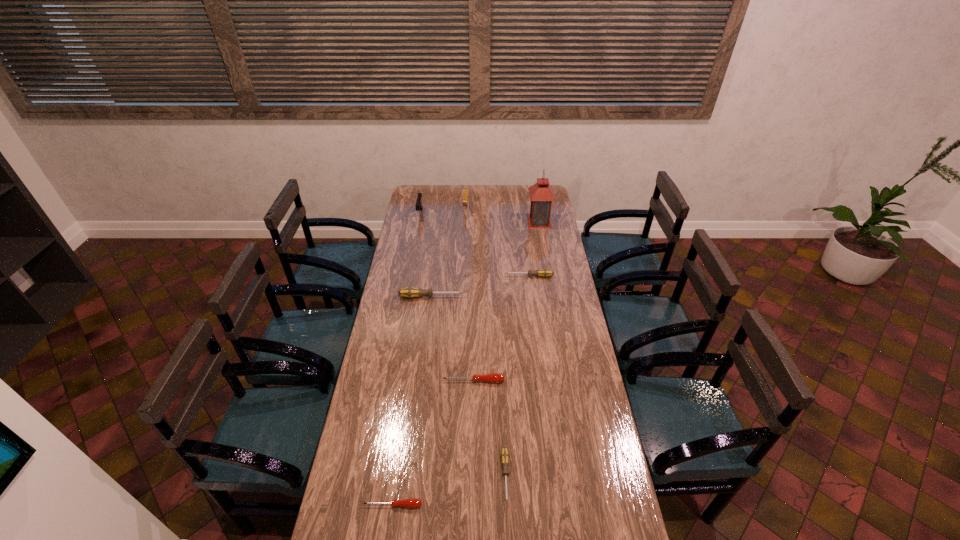
I want to click on vacant space situated 0.110m at the tip of the farthest screwdriver, so click(x=483, y=276).

What are the coordinates of `vacant space located 0.060m on the back of the right red screwdriver` in the screenshot? It's located at (473, 364).

Where is `vacant area situated at the tip of the second gray screwdriver from right to left`? vacant area situated at the tip of the second gray screwdriver from right to left is located at coordinates click(x=508, y=530).

At what (x,y) coordinates should I click in order to perform the action: click on vacant space situated on the right of the nearer red screwdriver. Please return your answer as a coordinate pair (x, y). This screenshot has height=540, width=960. Looking at the image, I should click on (536, 505).

Find the location of a particular element. This screenshot has width=960, height=540. object located at the far edge is located at coordinates (465, 190).

What are the coordinates of `pistol located at the left edge` in the screenshot? It's located at (419, 206).

In order to click on lantern located in the right edge section of the desktop in this screenshot , I will do `click(541, 194)`.

The height and width of the screenshot is (540, 960). Find the location of `screwdriver located at the right edge`. screwdriver located at the right edge is located at coordinates (544, 272).

What are the coordinates of `free spot at the far edge of the desktop` in the screenshot? It's located at (514, 195).

The image size is (960, 540). What are the coordinates of `free region at the left edge of the desktop` in the screenshot? It's located at (409, 312).